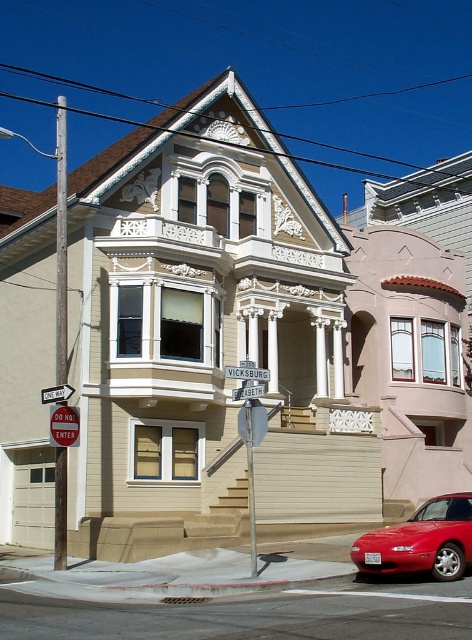
You are standing in front of the Victorian house and want to take a photo. You notice two points marked on the image at coordinates point (61, 538) and point (253, 372). Which point should you focus on first to ensure both are in sharp focus?

You should focus on point (61, 538) first because it is closer to the camera than point (253, 372). This ensures that both points will be in focus as the closer point determines the depth of field.